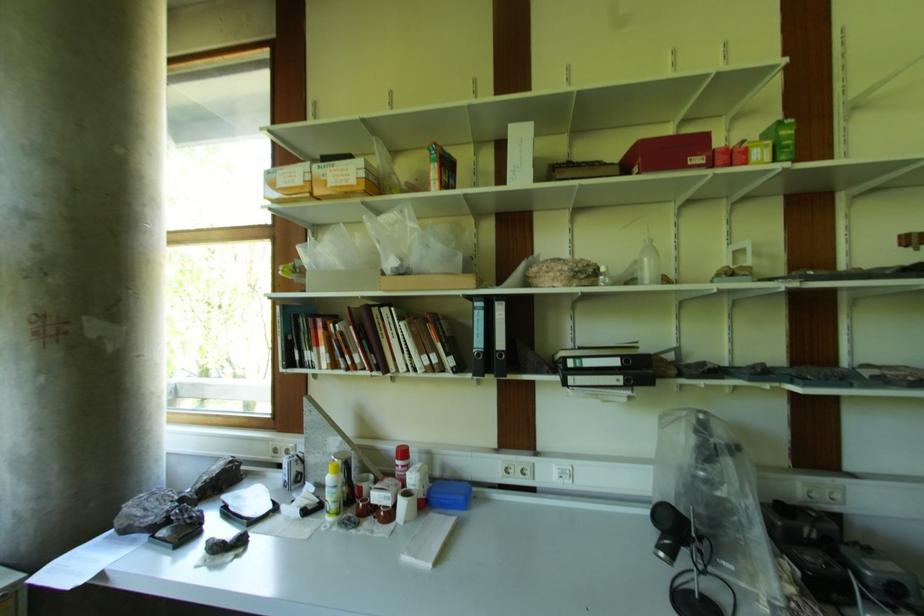
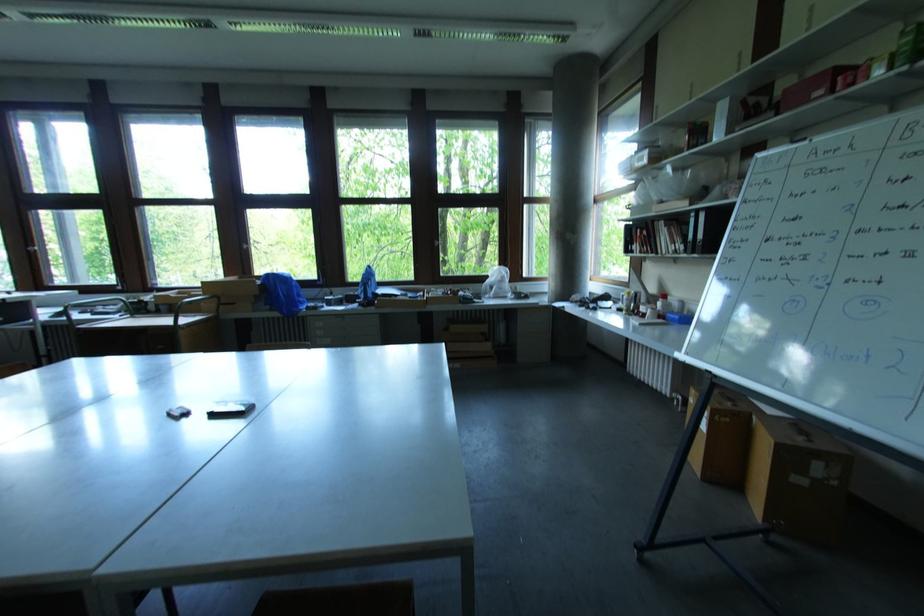
In the second image, find the point that corresponds to [407,454] in the first image.

(667, 298)